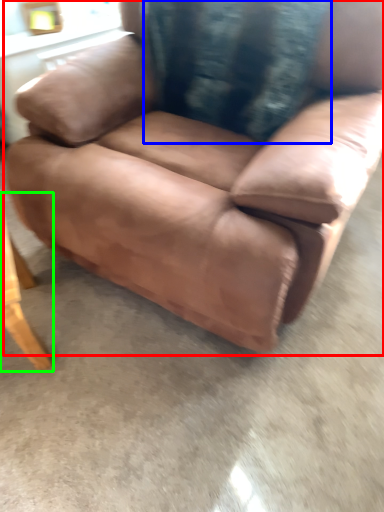
Question: Which object is the closest to the chair (highlighted by a red box)? Choose among these: pillow (highlighted by a blue box) or table (highlighted by a green box).

Choices:
 (A) pillow
 (B) table

Answer: (A)